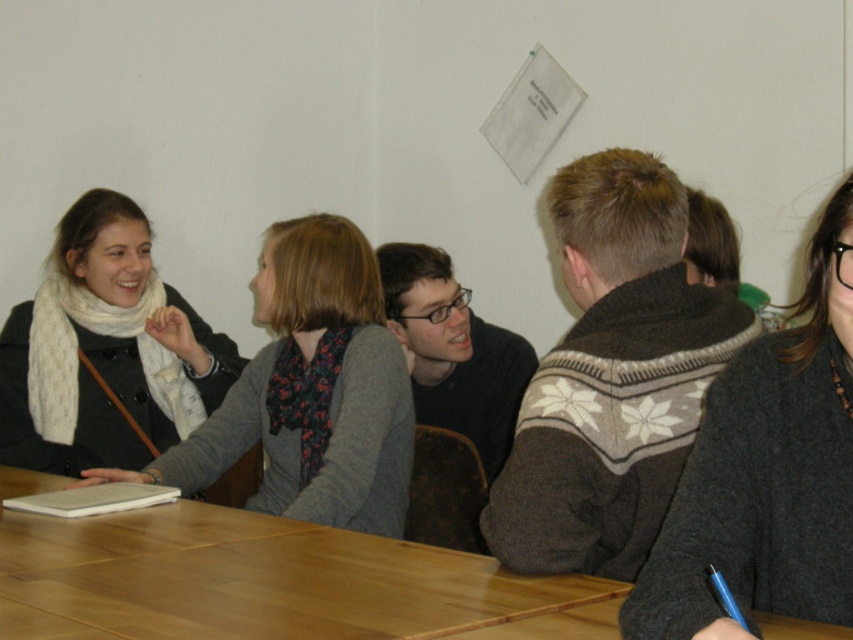
Question: Can you confirm if wooden table at center is bigger than white scarf at left?

Choices:
 (A) no
 (B) yes

Answer: (A)

Question: Can you confirm if dark gray sweater at right is positioned above white scarf at upper left?

Choices:
 (A) yes
 (B) no

Answer: (B)

Question: Is wooden table at center to the left of dark gray sweater at right from the viewer's perspective?

Choices:
 (A) no
 (B) yes

Answer: (B)

Question: Among these points, which one is farthest from the camera?

Choices:
 (A) (206, 515)
 (B) (718, 612)
 (C) (267, 307)
 (D) (196, 417)

Answer: (D)

Question: Which of these objects is positioned closest to the dark gray sweater at right?

Choices:
 (A) white scarf at left
 (B) white scarf at upper left

Answer: (B)

Question: Among these objects, which one is farthest from the camera?

Choices:
 (A) wooden table at center
 (B) white scarf at left

Answer: (B)